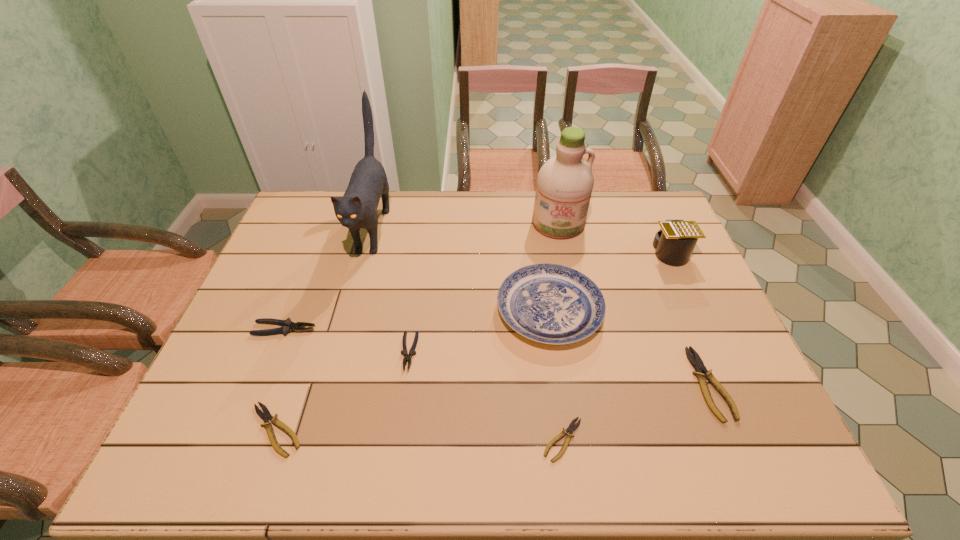
You are a GUI agent. You are given a task and a screenshot of the screen. Output one action in this format:
    pyautogui.click(x=<x>, y=<y>)
    Task: Click on the blank space located 0.110m on the front of the rightmost yellow pliers
    Image resolution: width=960 pixels, height=540 pixels.
    Given the screenshot: What is the action you would take?
    pyautogui.click(x=747, y=472)

The width and height of the screenshot is (960, 540). Find the location of `vacant region located at the gripping part of the smaller gray pliers`. vacant region located at the gripping part of the smaller gray pliers is located at coordinates (402, 401).

This screenshot has width=960, height=540. In order to click on vacant space located on the right of the second shortest pliers in this screenshot , I will do `click(438, 430)`.

The height and width of the screenshot is (540, 960). I want to click on free space located on the back of the smallest yellow pliers, so click(x=552, y=360).

The image size is (960, 540). I want to click on cat positioned at the far edge, so click(x=357, y=208).

Where is `cleansing agent that is at the far edge`? Image resolution: width=960 pixels, height=540 pixels. cleansing agent that is at the far edge is located at coordinates (565, 182).

Locate an element on the screen. This screenshot has height=540, width=960. calculator that is positioned at the right edge is located at coordinates (674, 243).

Find the location of a particular element. pliers that is at the right edge is located at coordinates (702, 373).

The width and height of the screenshot is (960, 540). What are the coordinates of `object positioned at the near left corner` in the screenshot? It's located at (265, 415).

Image resolution: width=960 pixels, height=540 pixels. I want to click on free space at the far edge of the desktop, so click(441, 228).